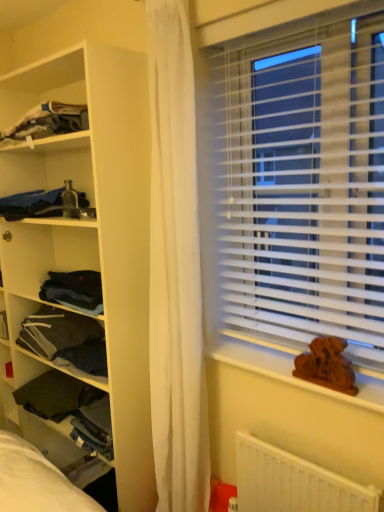
Question: Considering the relative sizes of dark blue fabric at upper left, acting as the 4th clothing starting from the bottom, and white plastic blinds at right in the image provided, is dark blue fabric at upper left, acting as the 4th clothing starting from the bottom, smaller than white plastic blinds at right?

Choices:
 (A) no
 (B) yes

Answer: (B)

Question: Is dark blue fabric at upper left, acting as the 4th clothing starting from the bottom, oriented away from white plastic blinds at right?

Choices:
 (A) yes
 (B) no

Answer: (B)

Question: Is white plastic blinds at right completely or partially inside dark blue fabric at upper left, acting as the 4th clothing starting from the bottom?

Choices:
 (A) yes
 (B) no

Answer: (B)

Question: Can we say dark blue fabric at upper left, acting as the 4th clothing starting from the bottom, lies outside white plastic blinds at right?

Choices:
 (A) yes
 (B) no

Answer: (A)

Question: Can you confirm if dark blue fabric at upper left, acting as the 4th clothing starting from the bottom, is positioned to the right of white plastic blinds at right?

Choices:
 (A) yes
 (B) no

Answer: (B)

Question: Is dark blue fabric at upper left, arranged as the 1th clothing when viewed from the top, touching white plastic blinds at right?

Choices:
 (A) no
 (B) yes

Answer: (A)

Question: Can you confirm if dark gray fabric at left, the 3th clothing from the top, is positioned to the left of white matte shelf at left?

Choices:
 (A) no
 (B) yes

Answer: (B)

Question: Is dark gray fabric at left, the 3th clothing from the top, not near white matte shelf at left?

Choices:
 (A) yes
 (B) no

Answer: (B)

Question: Is dark gray fabric at left, placed as the 2th clothing when sorted from bottom to top, positioned behind white matte shelf at left?

Choices:
 (A) no
 (B) yes

Answer: (B)

Question: Is dark gray fabric at left, placed as the 2th clothing when sorted from bottom to top, bigger than white matte shelf at left?

Choices:
 (A) yes
 (B) no

Answer: (B)

Question: Does dark gray fabric at left, the 3th clothing from the top, have a greater width compared to white matte shelf at left?

Choices:
 (A) yes
 (B) no

Answer: (B)

Question: Is dark gray fabric at left, placed as the 2th clothing when sorted from bottom to top, next to white matte shelf at left and touching it?

Choices:
 (A) no
 (B) yes

Answer: (A)

Question: From the image's perspective, would you say dark blue fabric at upper left, arranged as the 1th clothing when viewed from the top, is positioned over dark gray fabric at left, placed as the 2th clothing when sorted from bottom to top?

Choices:
 (A) no
 (B) yes

Answer: (B)